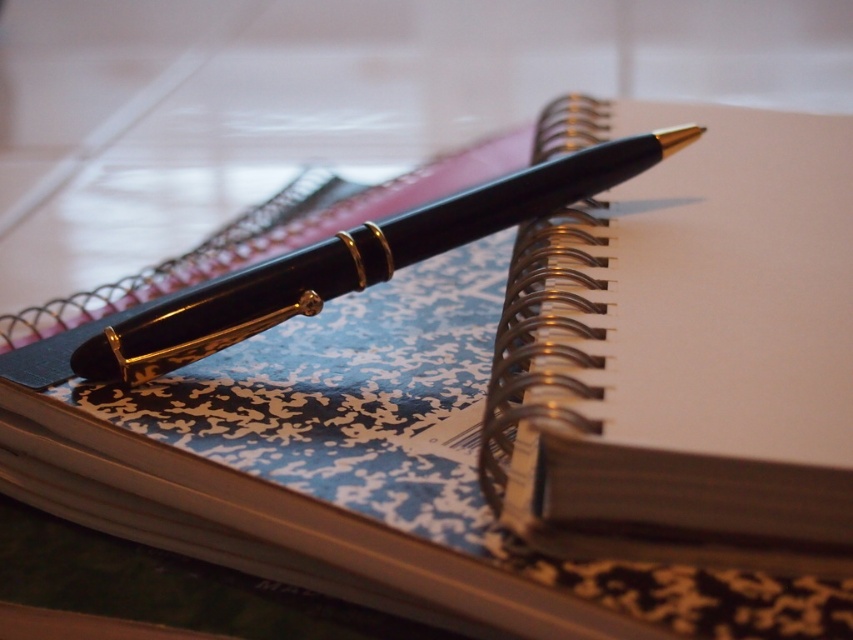
Question: Which point is closer to the camera?

Choices:
 (A) (584, 170)
 (B) (610, 248)

Answer: (B)

Question: In this image, where is matte black notepad at upper right located relative to matte black pen at center?

Choices:
 (A) above
 (B) below

Answer: (B)

Question: Does matte black notepad at upper right appear under matte black pen at center?

Choices:
 (A) yes
 (B) no

Answer: (A)

Question: Which point is closer to the camera?

Choices:
 (A) (735, 525)
 (B) (490, 205)

Answer: (A)

Question: In this image, where is matte black notepad at upper right located relative to matte black pen at center?

Choices:
 (A) below
 (B) above

Answer: (A)

Question: Which of the following is the farthest from the observer?

Choices:
 (A) matte black pen at center
 (B) matte black notepad at upper right

Answer: (A)